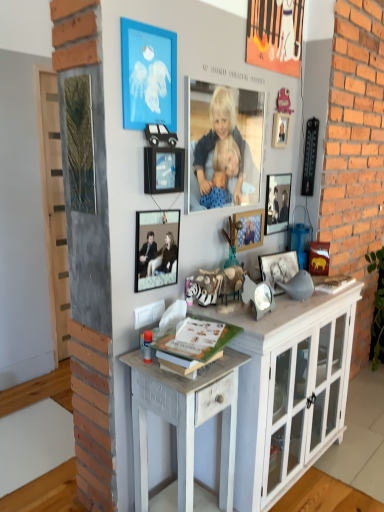
Question: Considering the relative positions of white distressed wood desk at center and smooth blue fabric at center in the image provided, is white distressed wood desk at center in front of smooth blue fabric at center?

Choices:
 (A) yes
 (B) no

Answer: (A)

Question: Considering the relative sizes of white distressed wood desk at center and smooth blue fabric at center in the image provided, is white distressed wood desk at center shorter than smooth blue fabric at center?

Choices:
 (A) yes
 (B) no

Answer: (B)

Question: Is white distressed wood desk at center turned away from smooth blue fabric at center?

Choices:
 (A) yes
 (B) no

Answer: (B)

Question: From the image's perspective, is white distressed wood desk at center located beneath smooth blue fabric at center?

Choices:
 (A) no
 (B) yes

Answer: (B)

Question: Does white distressed wood desk at center turn towards smooth blue fabric at center?

Choices:
 (A) yes
 (B) no

Answer: (B)

Question: Does point (140, 442) appear closer or farther from the camera than point (278, 227)?

Choices:
 (A) farther
 (B) closer

Answer: (B)

Question: Based on their sizes in the image, would you say white distressed wood desk at center is bigger or smaller than metallic silver photo frame at center, which ranks as the 6th picture frame in left-to-right order?

Choices:
 (A) small
 (B) big

Answer: (B)

Question: From a real-world perspective, is white distressed wood desk at center physically located above or below metallic silver photo frame at center, placed as the first picture frame when sorted from right to left?

Choices:
 (A) below
 (B) above

Answer: (A)

Question: From the image's perspective, is white distressed wood desk at center above or below metallic silver photo frame at center, placed as the first picture frame when sorted from right to left?

Choices:
 (A) below
 (B) above

Answer: (A)

Question: Looking at the image, does black matte picture frame at center, the fifth picture frame viewed from the left, seem bigger or smaller compared to blue matte picture frame at upper center, which is counted as the first picture frame, starting from the left?

Choices:
 (A) big
 (B) small

Answer: (A)

Question: Is point (284, 252) closer or farther from the camera than point (165, 64)?

Choices:
 (A) closer
 (B) farther

Answer: (B)

Question: Visually, is black matte picture frame at center, the fifth picture frame viewed from the left, positioned to the left or to the right of blue matte picture frame at upper center, which is counted as the sixth picture frame, starting from the right?

Choices:
 (A) right
 (B) left

Answer: (A)

Question: In terms of width, does black matte picture frame at center, the fifth picture frame viewed from the left, look wider or thinner when compared to blue matte picture frame at upper center, which is counted as the sixth picture frame, starting from the right?

Choices:
 (A) thin
 (B) wide

Answer: (B)

Question: Is point (278, 280) positioned closer to the camera than point (205, 345)?

Choices:
 (A) closer
 (B) farther

Answer: (B)

Question: Which is correct: black matte picture frame at center, which is the 2th picture frame from right to left, is inside green matte book at center, or outside of it?

Choices:
 (A) outside
 (B) inside

Answer: (A)